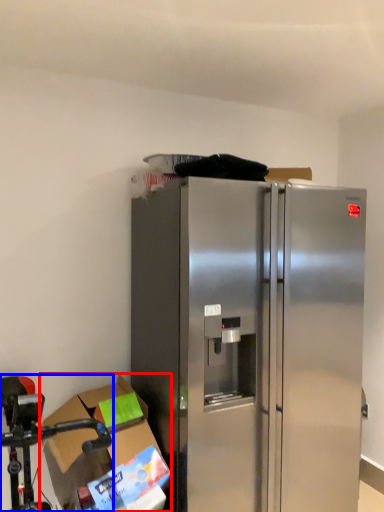
Question: Which object is closer to the camera taking this photo, cardboard box (highlighted by a red box) or stainless steel (highlighted by a blue box)?

Choices:
 (A) cardboard box
 (B) stainless steel

Answer: (B)